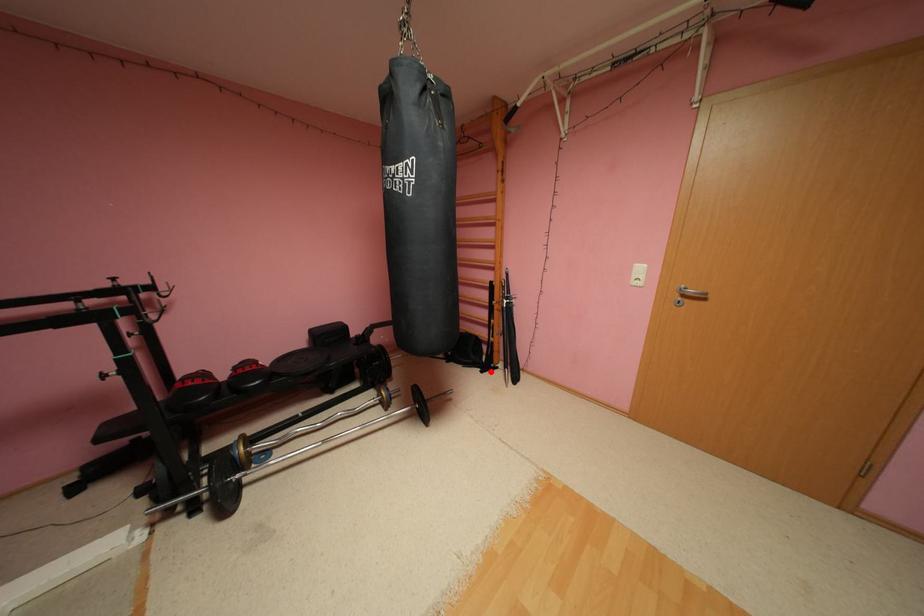
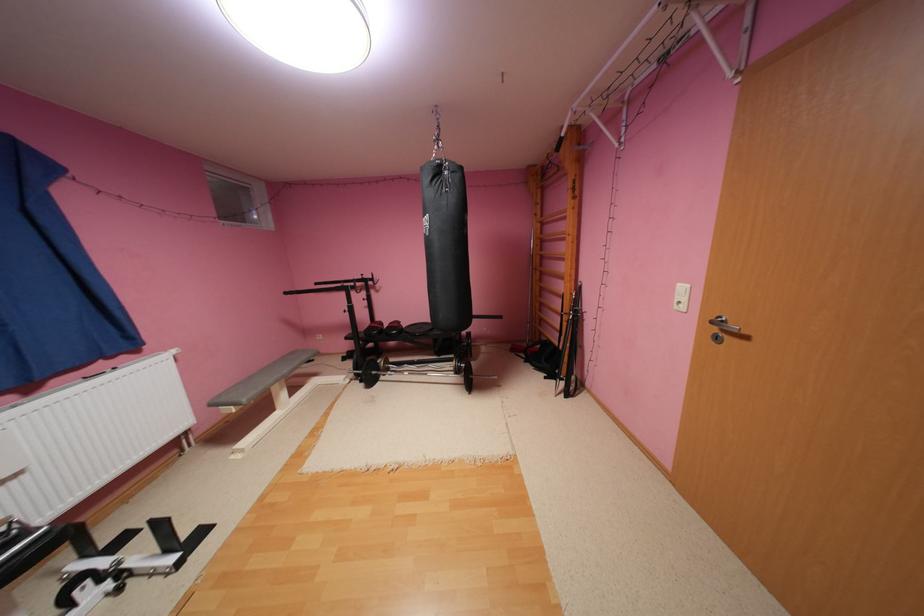
Find the pixel in the second image that matches the highlighted location in the first image.

(554, 378)